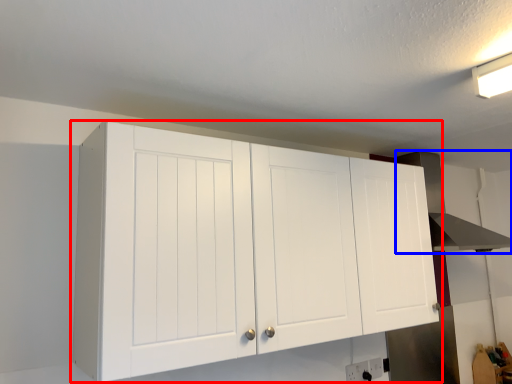
Question: Which object is further to the camera taking this photo, cupboard (highlighted by a red box) or vent (highlighted by a blue box)?

Choices:
 (A) cupboard
 (B) vent

Answer: (B)